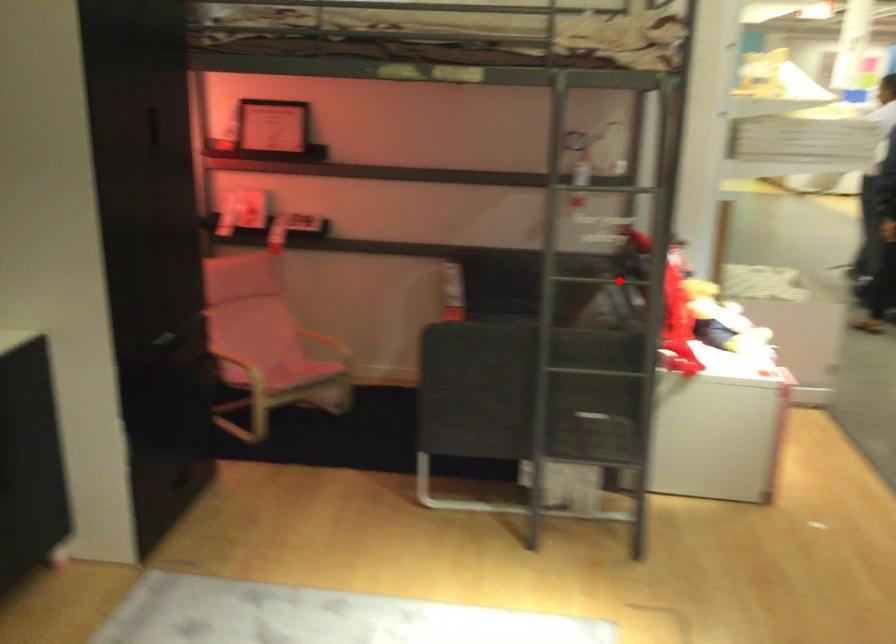
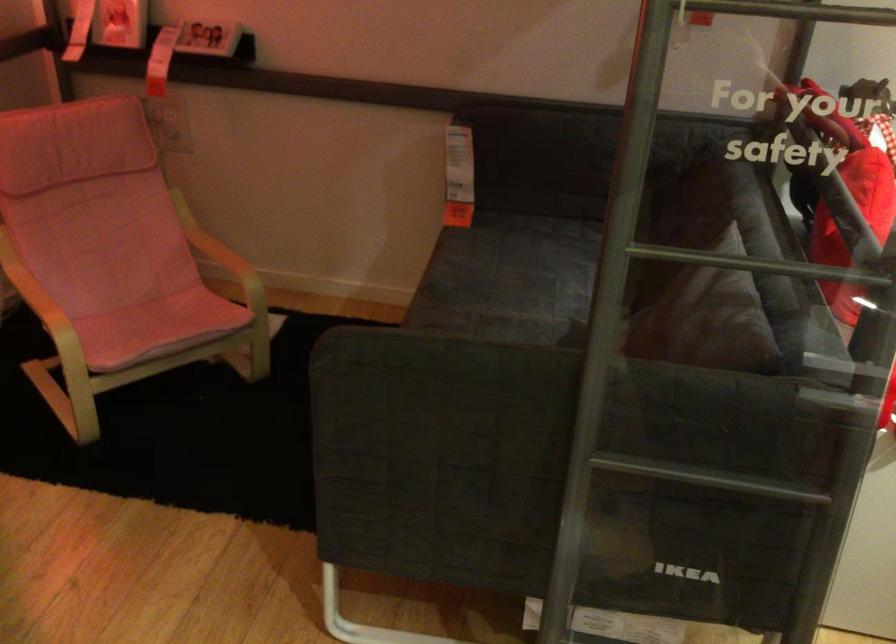
Question: A red point is marked in image1. In image2, is the corresponding 3D point closer to the camera or farther? Reply with the corresponding letter.

Choices:
 (A) The corresponding 3D point is closer.
 (B) The corresponding 3D point is farther.

Answer: (A)